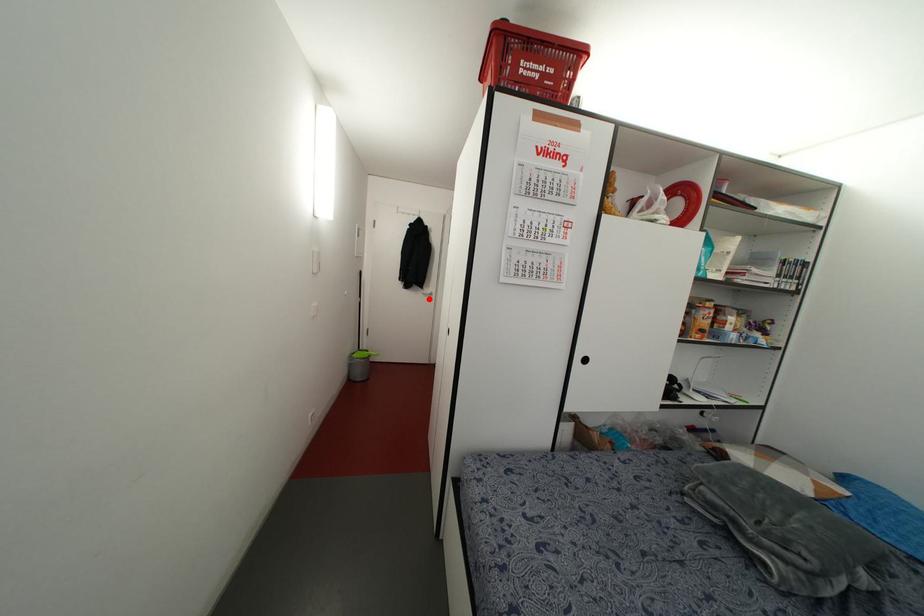
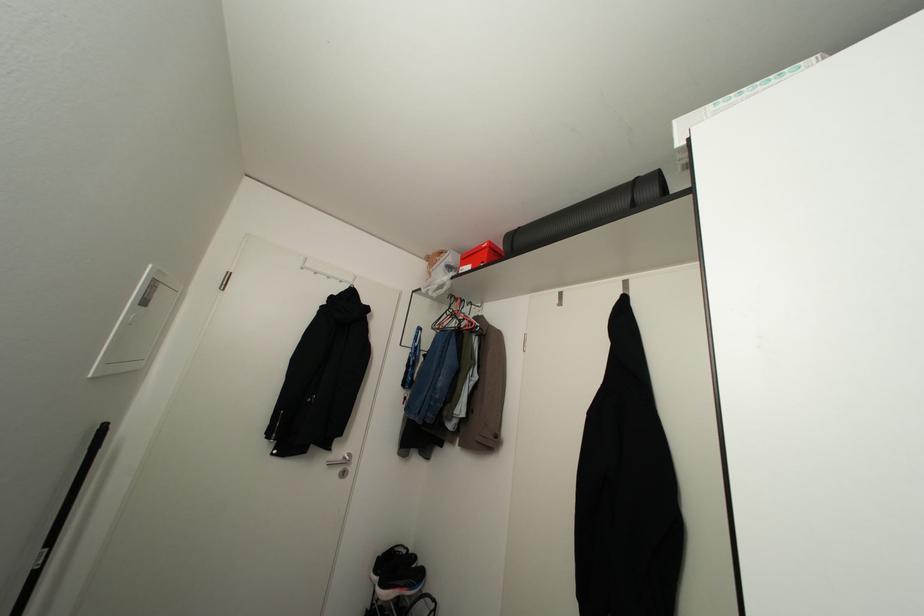
Question: I am providing you with two images of the same scene from different viewpoints. A red point is marked on the first image. Can you still see the location of the red point in image 2?

Choices:
 (A) Yes
 (B) No

Answer: (A)